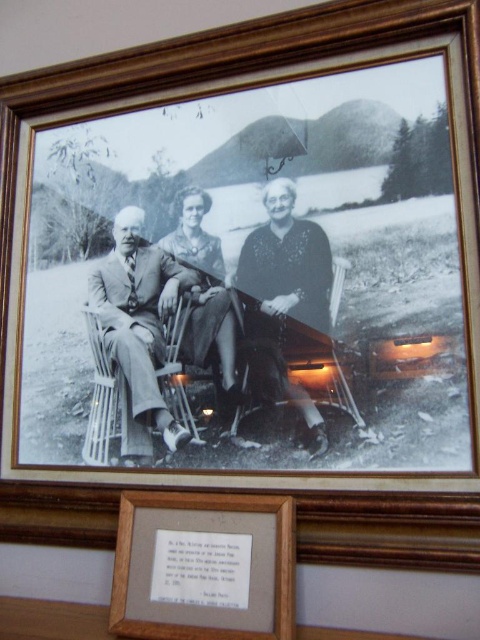
Does point (155, 317) come behind point (333, 301)?

Yes.

Can you confirm if matte suit at left is positioned to the right of wooden chair at lower center?

Incorrect, matte suit at left is not on the right side of wooden chair at lower center.

Between point (156, 346) and point (314, 333), which one is positioned in front?

Point (314, 333)

The width and height of the screenshot is (480, 640). What are the coordinates of `matte suit at left` in the screenshot? It's located at (137, 328).

Does point (289, 396) come in front of point (243, 321)?

Yes, it is in front of point (243, 321).

Can you confirm if smooth fabric suit at center is positioned to the left of wooden chair at lower center?

Correct, you'll find smooth fabric suit at center to the left of wooden chair at lower center.

Is point (121, 221) positioned after point (340, 275)?

Yes.

You are a GUI agent. You are given a task and a screenshot of the screen. Output one action in this format:
    pyautogui.click(x=<x>, y=<y>)
    Task: Click on the smooth fabric suit at center
    The width and height of the screenshot is (480, 640).
    Given the screenshot: What is the action you would take?
    pyautogui.click(x=205, y=308)

Who is higher up, matte black dress at center or wooden chair at lower center?

matte black dress at center is higher up.

This screenshot has width=480, height=640. What do you see at coordinates (206, 298) in the screenshot? I see `matte black dress at center` at bounding box center [206, 298].

Image resolution: width=480 pixels, height=640 pixels. In order to click on matte black dress at center in this screenshot , I will do `click(206, 298)`.